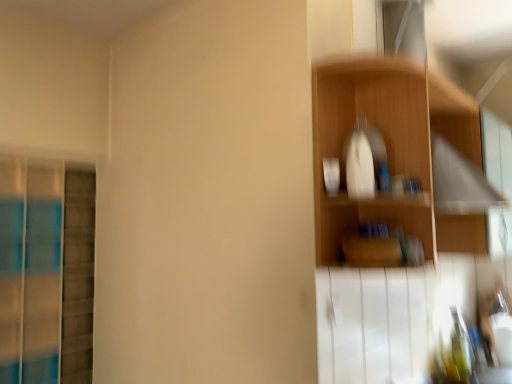
Question: In the image, is blue glass screen door at left positioned in front of or behind wooden shelf at upper right?

Choices:
 (A) front
 (B) behind

Answer: (B)

Question: Looking at the image, does blue glass screen door at left seem bigger or smaller compared to wooden shelf at upper right?

Choices:
 (A) small
 (B) big

Answer: (B)

Question: From their relative heights in the image, would you say blue glass screen door at left is taller or shorter than wooden shelf at upper right?

Choices:
 (A) tall
 (B) short

Answer: (A)

Question: In the image, is wooden shelf at upper right positioned in front of or behind blue glass screen door at left?

Choices:
 (A) behind
 (B) front

Answer: (B)

Question: Considering the positions of wooden shelf at upper right and blue glass screen door at left in the image, is wooden shelf at upper right taller or shorter than blue glass screen door at left?

Choices:
 (A) short
 (B) tall

Answer: (A)

Question: Is wooden shelf at upper right bigger or smaller than blue glass screen door at left?

Choices:
 (A) small
 (B) big

Answer: (A)

Question: Considering the relative positions of wooden shelf at upper right and blue glass screen door at left in the image provided, is wooden shelf at upper right to the left or to the right of blue glass screen door at left?

Choices:
 (A) left
 (B) right

Answer: (B)